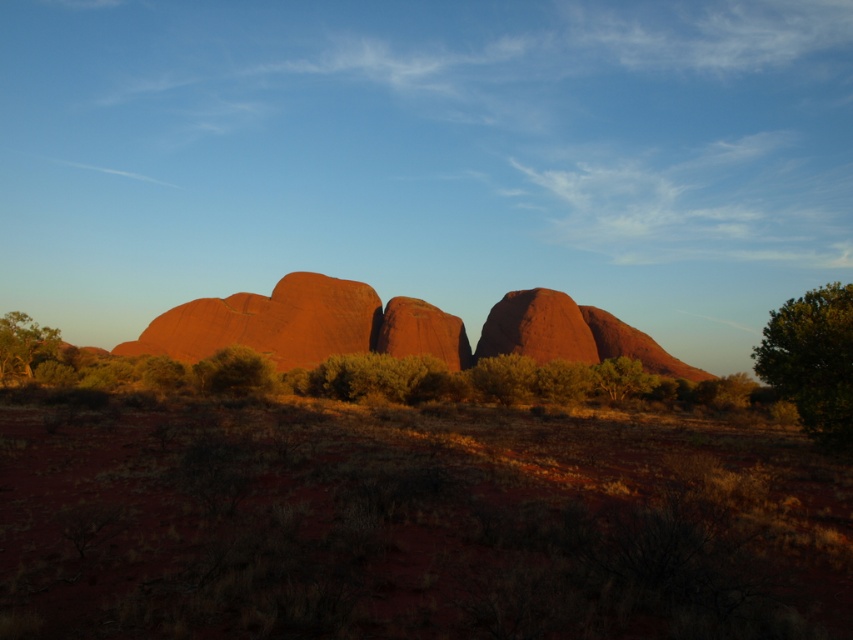
You are standing at the base of the Kata Tjuta rock formations and notice two points marked in the image. One is at coordinate point (386, 445) and the other at point (833, 324). Which of these points is physically closer to your current position?

Point (386, 445) is closer to the camera than point (833, 324), so the point at coordinate (386, 445) is physically closer to your current position.

You are a hiker planning to walk from the green leafy shrub at lower left to the rustic sandstone rock formation at center. Based on the scene, which direction should you head to reach the rock formation?

The rustic sandstone rock formation at center is positioned over the green leafy shrub at lower left, so you should head upward from the green leafy shrub at lower left to reach the rustic sandstone rock formation at center.

You are standing at the point marked as point (410, 522) in the image. Looking around, you see the large red rock formations of Kata Tjuta in the background. What type of terrain is directly beneath your feet?

The point (410, 522) is on dried grass at center, so the terrain directly beneath your feet is dried grass.